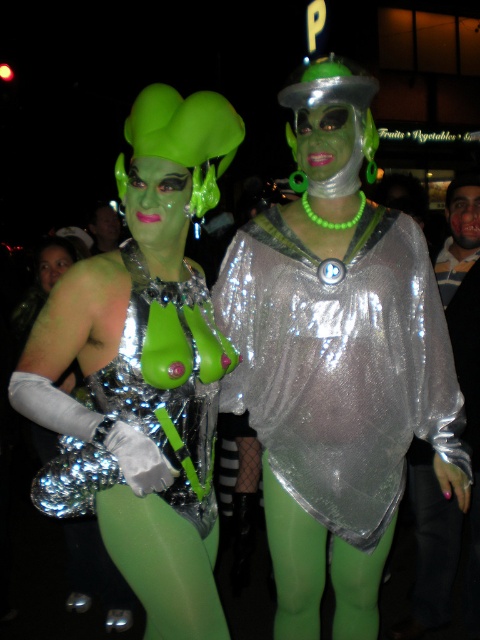
Can you confirm if green metallic dress at center is shorter than shiny metallic top at center?

No.

Is point (201, 154) positioned after point (308, 365)?

No.

Where is `green metallic dress at center`? green metallic dress at center is located at coordinates (144, 371).

Based on the photo, who is positioned more to the right, shiny metallic dress at center or green matte face paint at right?

From the viewer's perspective, green matte face paint at right appears more on the right side.

Which is more to the left, shiny metallic dress at center or green matte face paint at right?

shiny metallic dress at center is more to the left.

Does point (173, 388) lie behind point (475, 196)?

No, it is not.

This screenshot has width=480, height=640. In order to click on shiny metallic dress at center in this screenshot , I will do `click(168, 380)`.

Is point (304, 380) farther from viewer compared to point (460, 278)?

No, it is not.

Which is more to the left, shiny metallic top at center or green matte face paint at right?

shiny metallic top at center is more to the left.

Describe the element at coordinates (339, 364) in the screenshot. I see `shiny metallic top at center` at that location.

Locate an element on the screen. shiny metallic top at center is located at coordinates (339, 364).